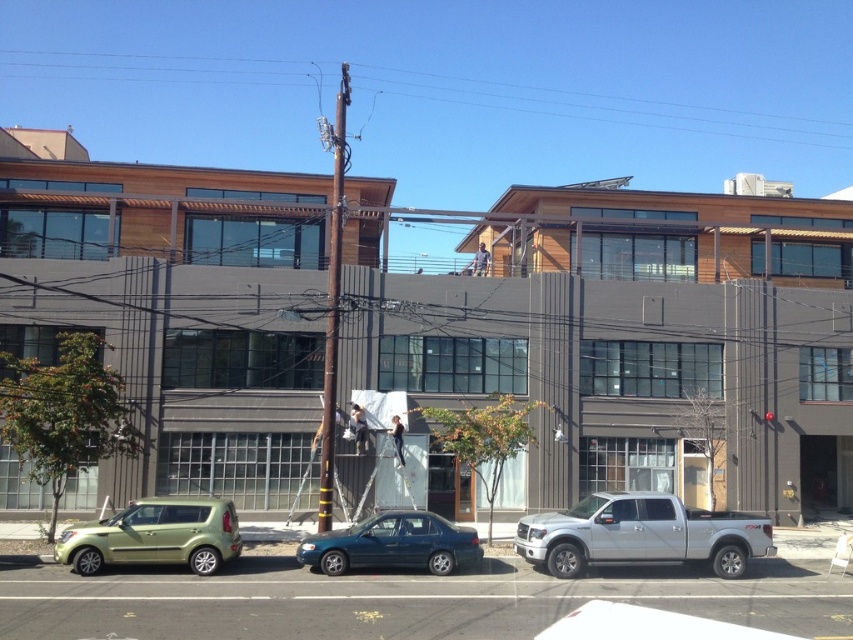
Based on the photo, does silver metallic truck at lower right have a lesser width compared to teal glossy sedan at center?

In fact, silver metallic truck at lower right might be wider than teal glossy sedan at center.

Is point (648, 560) farther from viewer compared to point (399, 544)?

Yes, point (648, 560) is behind point (399, 544).

Is point (560, 556) closer to viewer compared to point (465, 531)?

Yes, point (560, 556) is in front of point (465, 531).

I want to click on silver metallic truck at lower right, so click(x=640, y=534).

Based on the photo, does metallic pole at upper center have a smaller size compared to silver metallic truck at lower right?

Actually, metallic pole at upper center might be larger than silver metallic truck at lower right.

Consider the image. Is metallic pole at upper center to the right of silver metallic truck at lower right from the viewer's perspective?

Result: No, metallic pole at upper center is not to the right of silver metallic truck at lower right.

Locate an element on the screen. metallic pole at upper center is located at coordinates (605, 108).

Is silver metallic truck at lower right shorter than metallic green hatchback at lower left?

No.

Which is above, silver metallic truck at lower right or metallic green hatchback at lower left?

silver metallic truck at lower right is higher up.

At what (x,y) coordinates should I click in order to perform the action: click on silver metallic truck at lower right. Please return your answer as a coordinate pair (x, y). The image size is (853, 640). Looking at the image, I should click on (640, 534).

Identify the location of silver metallic truck at lower right. The image size is (853, 640). (640, 534).